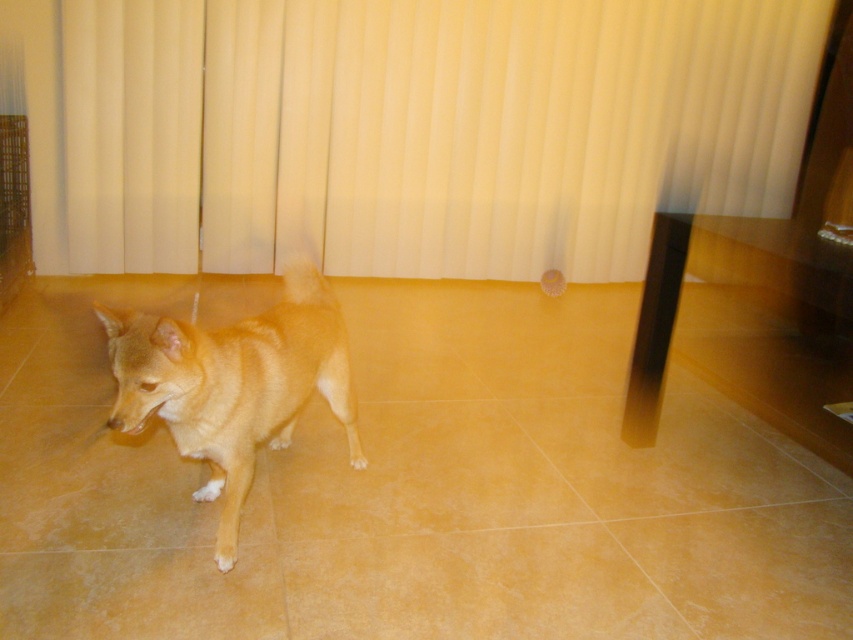
You are a visitor in the room and want to locate the beige fabric curtain at upper center. From the perspective of the golden fur dog at center, which direction should you look to find it?

The beige fabric curtain at upper center is to the right of the golden fur dog at center, so you should look to your right to find it.

You are a photographer setting up a shot in this room. You want to position a light source between the beige fabric curtain at upper center and the golden fur dog at center. Which object should the light source be closer to?

The light source should be placed closer to the golden fur dog at center because the beige fabric curtain at upper center is further away from the viewer than the golden fur dog at center.